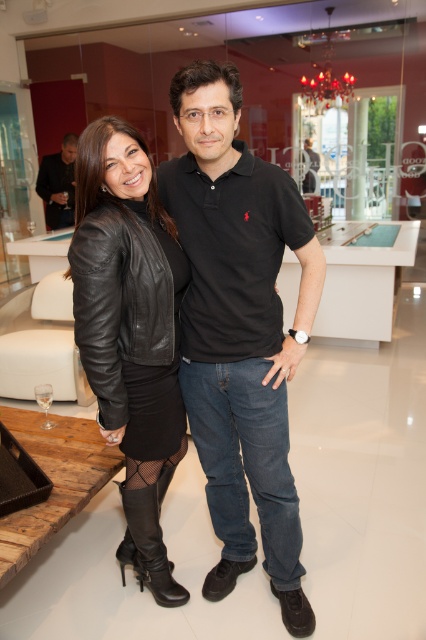
You are at a store and need to find the black leather jacket at left and the black leather polo shirt at center. According to the store layout, which item is positioned to the left?

The black leather jacket at left is positioned to the left of the black leather polo shirt at center.

In the scene shown: You are a fashion designer observing two black leather jackets in the image. The first is labeled as the black leather jacket at center, and the second is the black leather jacket at left. Based on their positions and sizes, which one would you recommend for a client who prefers a more voluminous style?

The black leather jacket at center has a larger size compared to the black leather jacket at left, so it would be the better recommendation for a client preferring a more voluminous style.

You are a photographer standing 1.6 meters away from the camera. You want to take a photo of the black leather polo shirt at center. Can you reach it without moving your position?

The black leather polo shirt at center is 1.45 meters away from the camera. Since you are 1.6 meters away from the camera, you are slightly farther than the subject. You may need to adjust your position or use a zoom lens to capture it clearly.